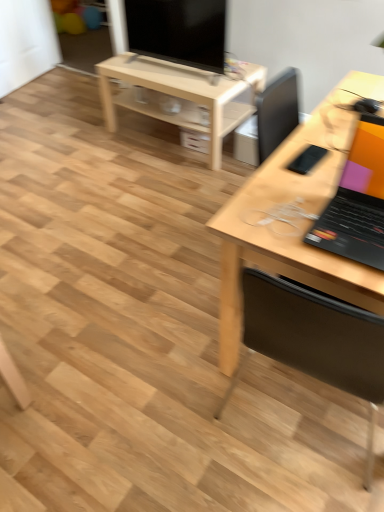
Where is `matte black tv at upper center`? Image resolution: width=384 pixels, height=512 pixels. matte black tv at upper center is located at coordinates (178, 31).

Find the location of a particular element. wooden chair at right is located at coordinates (314, 341).

What do you see at coordinates (314, 341) in the screenshot? I see `wooden chair at right` at bounding box center [314, 341].

In order to face light wood desk at right, should I rotate leftwards or rightwards?

You should rotate right by 22.367 degrees.

This screenshot has width=384, height=512. I want to click on matte black tv at upper center, so click(x=178, y=31).

Are wooden chair at right and light wood desk at right located far from each other?

wooden chair at right is actually quite close to light wood desk at right.

Is wooden chair at right bigger or smaller than light wood desk at right?

Considering their sizes, wooden chair at right takes up less space than light wood desk at right.

Does point (244, 276) come closer to viewer compared to point (209, 228)?

Yes, point (244, 276) is closer to viewer.

Measure the distance from wooden chair at right to light wood desk at right.

wooden chair at right and light wood desk at right are 29.81 centimeters apart.

Is point (379, 123) farther from camera compared to point (257, 217)?

Yes, it is behind point (257, 217).

Is black matte laptop at right positioned behind light wood desk at right?

No, black matte laptop at right is closer to the camera.

Which of these two, black matte laptop at right or light wood desk at right, stands shorter?

black matte laptop at right.

From a real-world perspective, is black matte laptop at right positioned over light wood desk at right based on gravity?

Correct, in the physical world, black matte laptop at right is higher than light wood desk at right.

From the image's perspective, who appears lower, light wood/unfinished table at center or light wood desk at right?

light wood desk at right.

Which of these two, light wood/unfinished table at center or light wood desk at right, is smaller?

With smaller size is light wood/unfinished table at center.

Is light wood/unfinished table at center situated inside light wood desk at right or outside?

light wood/unfinished table at center is outside light wood desk at right.

Based on the photo, in terms of height, does matte black tv at upper center look taller or shorter compared to wooden chair at right?

In the image, matte black tv at upper center appears to be shorter than wooden chair at right.

Who is smaller, matte black tv at upper center or wooden chair at right?

matte black tv at upper center is smaller.

Which object is thinner, matte black tv at upper center or wooden chair at right?

matte black tv at upper center is thinner.

Would you say light wood/unfinished table at center contains black matte laptop at right?

That's incorrect, black matte laptop at right is not inside light wood/unfinished table at center.

Looking at this image, which of these two, light wood/unfinished table at center or black matte laptop at right, stands shorter?

Standing shorter between the two is black matte laptop at right.

Is light wood/unfinished table at center bigger than black matte laptop at right?

Correct, light wood/unfinished table at center is larger in size than black matte laptop at right.

From a real-world perspective, is wooden chair at right located higher than light wood/unfinished table at center?

Indeed, from a real-world perspective, wooden chair at right stands above light wood/unfinished table at center.

The image size is (384, 512). I want to click on table on the left of wooden chair at right, so click(181, 95).

Is point (370, 371) closer or farther from the camera than point (130, 68)?

Point (370, 371) is positioned closer to the camera compared to point (130, 68).

Is wooden chair at right oriented away from light wood/unfinished table at center?

No.

From the image's perspective, is black matte laptop at right below light wood/unfinished table at center?

Correct, black matte laptop at right appears lower than light wood/unfinished table at center in the image.

Which of these two, black matte laptop at right or light wood/unfinished table at center, stands shorter?

black matte laptop at right is shorter.

Considering the points (350, 172) and (216, 125), which point is behind, point (350, 172) or point (216, 125)?

The point (216, 125) is farther.

Is black matte laptop at right placed right next to light wood/unfinished table at center?

No, black matte laptop at right is not making contact with light wood/unfinished table at center.

Locate an element on the screen. Image resolution: width=384 pixels, height=512 pixels. chair that is below the light wood desk at right (from the image's perspective) is located at coordinates (314, 341).

In the image, there is a light wood desk at right. At what (x,y) coordinates should I click in order to perform the action: click on laptop above it (from the image's perspective). Please return your answer as a coordinate pair (x, y). The height and width of the screenshot is (512, 384). Looking at the image, I should click on (357, 201).

Which object lies further to the anchor point light wood desk at right, light wood/unfinished table at center or black matte laptop at right?

light wood/unfinished table at center.

Based on their spatial positions, is wooden chair at right or matte black tv at upper center closer to light wood/unfinished table at center?

matte black tv at upper center.

Considering their positions, is wooden chair at right positioned closer to light wood/unfinished table at center than black matte laptop at right?

black matte laptop at right.

Which object lies further to the anchor point wooden chair at right, black matte laptop at right or matte black tv at upper center?

matte black tv at upper center lies further to wooden chair at right than the other object.

Based on their spatial positions, is black matte laptop at right or wooden chair at right further from light wood/unfinished table at center?

The object further to light wood/unfinished table at center is wooden chair at right.

Estimate the real-world distances between objects in this image. Which object is closer to black matte laptop at right, wooden chair at right or matte black tv at upper center?

Among the two, wooden chair at right is located nearer to black matte laptop at right.

Based on their spatial positions, is wooden chair at right or light wood/unfinished table at center further from matte black tv at upper center?

wooden chair at right lies further to matte black tv at upper center than the other object.

Estimate the real-world distances between objects in this image. Which object is closer to wooden chair at right, matte black tv at upper center or black matte laptop at right?

Based on the image, black matte laptop at right appears to be nearer to wooden chair at right.

At what (x,y) coordinates should I click in order to perform the action: click on laptop between matte black tv at upper center and wooden chair at right in the up-down direction. Please return your answer as a coordinate pair (x, y). Image resolution: width=384 pixels, height=512 pixels. Looking at the image, I should click on (357, 201).

Find the location of a particular element. The image size is (384, 512). desk between black matte laptop at right and matte black tv at upper center in the front-back direction is located at coordinates (293, 219).

Find the location of a particular element. The width and height of the screenshot is (384, 512). desk between black matte laptop at right and wooden chair at right vertically is located at coordinates (293, 219).

Where is `television positioned between wooden chair at right and light wood/unfinished table at center from near to far`? television positioned between wooden chair at right and light wood/unfinished table at center from near to far is located at coordinates pyautogui.click(x=178, y=31).